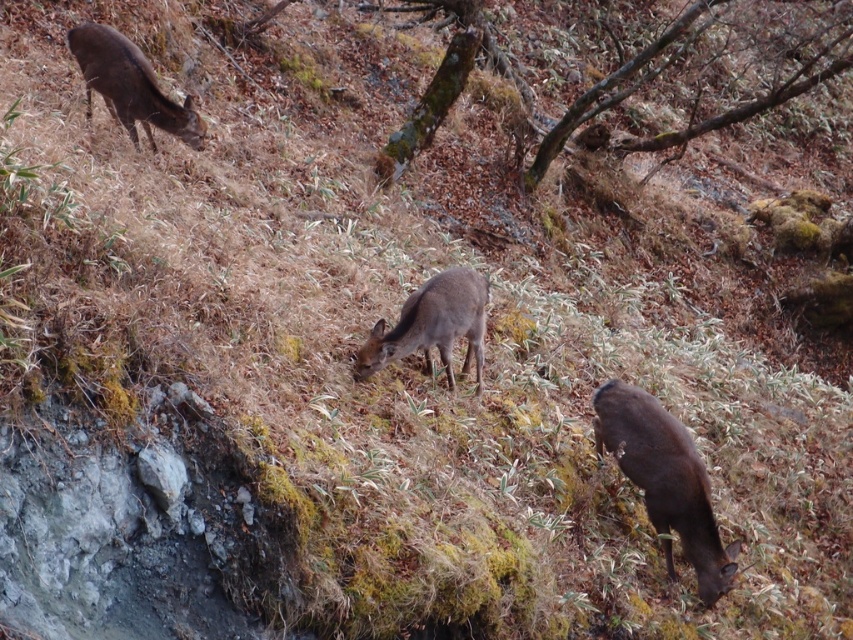
In the scene shown: Which of these two, brown matte deer at center or brown matte deer at upper left, stands taller?

brown matte deer at upper left

Which is more to the right, brown matte deer at center or brown matte deer at upper left?

Positioned to the right is brown matte deer at center.

Is point (398, 333) behind point (131, 86)?

No, it is not.

The height and width of the screenshot is (640, 853). I want to click on brown matte deer at center, so click(x=432, y=326).

Is brown matte deer at lower right taller than brown matte deer at upper left?

Yes.

Which is behind, point (663, 486) or point (103, 54)?

The point (103, 54) is more distant.

This screenshot has width=853, height=640. Describe the element at coordinates (665, 477) in the screenshot. I see `brown matte deer at lower right` at that location.

Where is `brown matte deer at lower right`? The image size is (853, 640). brown matte deer at lower right is located at coordinates (665, 477).

Who is shorter, brown matte deer at lower right or brown matte deer at center?

Standing shorter between the two is brown matte deer at center.

Describe the element at coordinates (665, 477) in the screenshot. I see `brown matte deer at lower right` at that location.

Is point (683, 540) in front of point (401, 333)?

No, it is behind (401, 333).

Locate an element on the screen. This screenshot has height=640, width=853. brown matte deer at lower right is located at coordinates (665, 477).